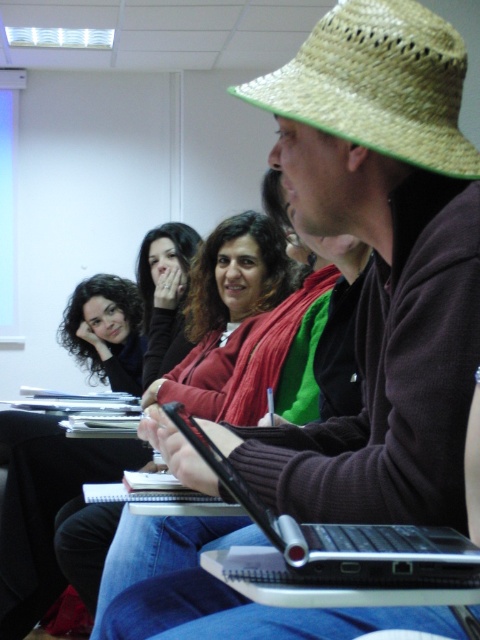
You are organizing a classroom activity and need to ensure that the black plastic laptop at center and the matte black hair at upper center are visible to everyone. Based on their sizes, which object should be placed closer to the front for better visibility?

The black plastic laptop at center should be placed closer to the front because it occupies less space than the matte black hair at upper center, making it smaller and potentially harder to see from a distance.

Based on the photo, you are a student in the classroom and need to place a book on the desk. The book requires a surface that is taller than the black plastic laptop at center but shorter than the matte black hair at upper center. Is there a suitable surface available on the desk?

The black plastic laptop at center is shorter than the matte black hair at upper center. However, the desk itself is a flat surface and does not have varying heights. Therefore, there is no surface on the desk that meets the requirement of being taller than the black plastic laptop at center but shorter than the matte black hair at upper center.